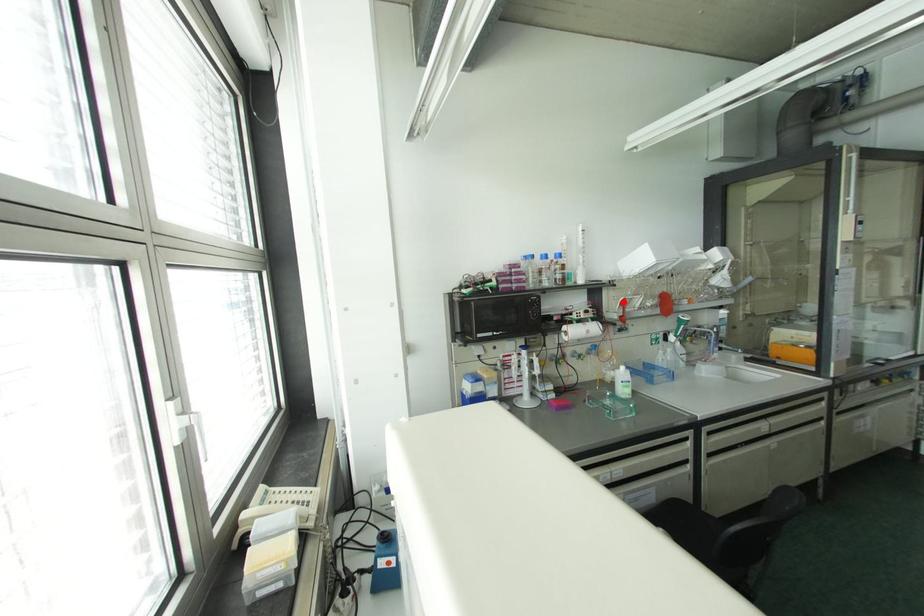
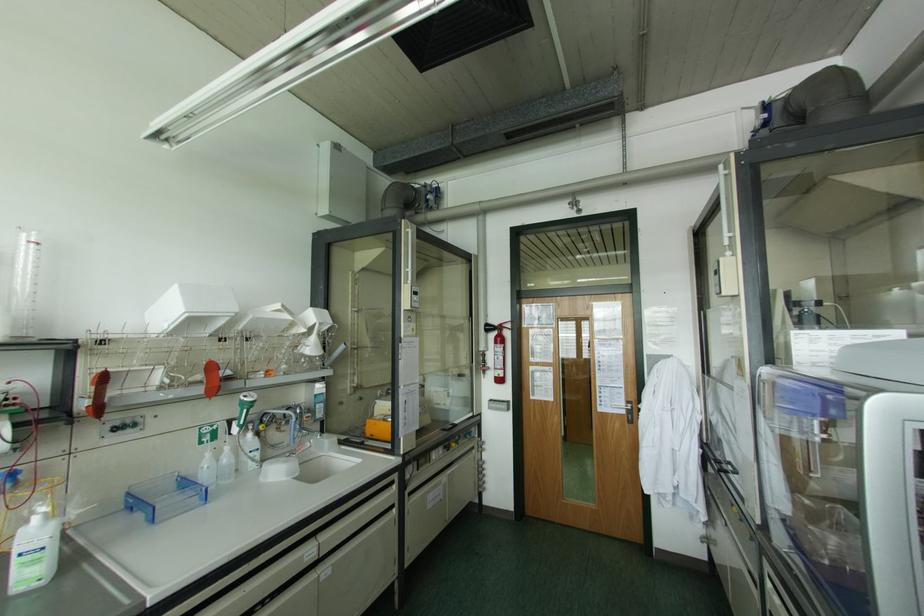
Question: I am providing you with two images of the same scene from different viewpoints. A red point is marked on the first image. Is the red point's position out of view in image 2?

Choices:
 (A) Yes
 (B) No

Answer: (B)